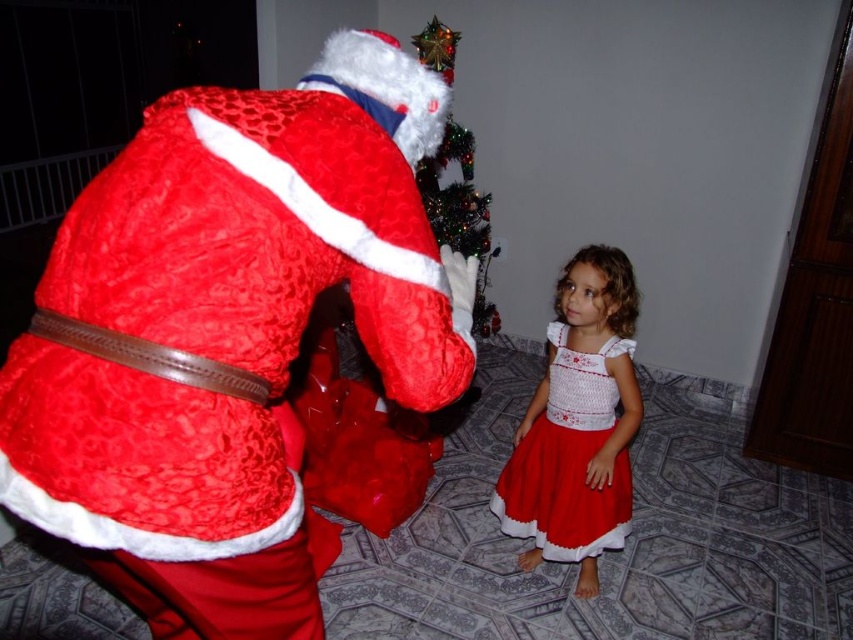
You are a photographer setting up for a Christmas photo session. You have a velvet red santa claus at upper left and a white crochet dress at lower right in the frame. Which object should you adjust to ensure both are in focus, considering their sizes and positions?

The velvet red santa claus at upper left is larger in size than the white crochet dress at lower right, so you should adjust the focus on the velvet red santa claus at upper left to ensure both are in focus.

From the picture: You are a parent trying to ensure your child stays safe during the Christmas celebration. Your child is wearing the white crochet dress at lower right and is near the green glittery christmas tree at upper center. The tree is decorated with small glass ornaments. Considering the distance between them, is there enough space for your child to move around without knocking over the tree?

The white crochet dress at lower right is 1.08 meters away from the green glittery christmas tree at upper center. This distance provides sufficient space for the child to move around safely without risking the tree being knocked over.

You are a photographer setting up for a Christmas photo shoot. You need to position a camera so that both the velvet red santa claus at upper left and the green glittery christmas tree at upper center are in frame. Based on their positions and sizes, which object should you ensure is closer to the camera to avoid it being cut off?

Since the velvet red santa claus at upper left might be wider than the green glittery christmas tree at upper center, you should position the camera closer to the velvet red santa claus at upper left to ensure it fits within the frame without being cut off.